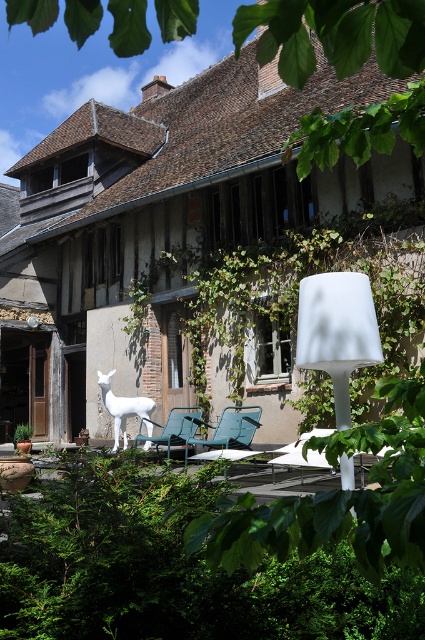
Measure the distance between green leafy bush at lower left and white matte lamp at center.

green leafy bush at lower left is 34.03 inches from white matte lamp at center.

Between green leafy bush at lower left and white matte lamp at center, which one has less height?

Standing shorter between the two is green leafy bush at lower left.

Measure the distance between point (78, 525) and camera.

They are 10.41 feet apart.

The image size is (425, 640). I want to click on green leafy bush at lower left, so pos(172,566).

Does green leafy bush at lower left have a larger size compared to metallic blue chair at center?

Yes, green leafy bush at lower left is bigger than metallic blue chair at center.

At what (x,y) coordinates should I click in order to perform the action: click on green leafy bush at lower left. Please return your answer as a coordinate pair (x, y). This screenshot has width=425, height=640. Looking at the image, I should click on (172, 566).

Between white glossy statue at center and metallic blue chair at center, which one appears on the left side from the viewer's perspective?

white glossy statue at center

Between point (147, 422) and point (139, 426), which one is positioned in front?

Point (147, 422)

Find the location of a particular element. The height and width of the screenshot is (640, 425). white glossy statue at center is located at coordinates (124, 408).